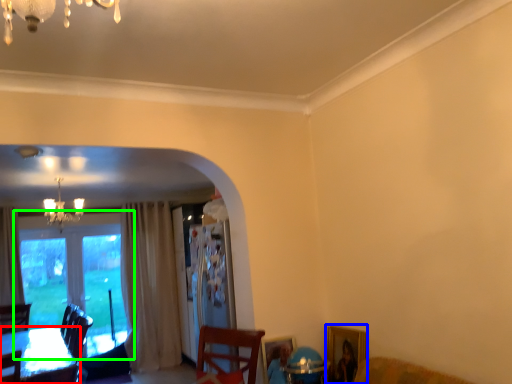
Question: Which object is the closest to the table (highlighted by a red box)? Choose among these: picture frame (highlighted by a blue box) or window (highlighted by a green box).

Choices:
 (A) picture frame
 (B) window

Answer: (B)